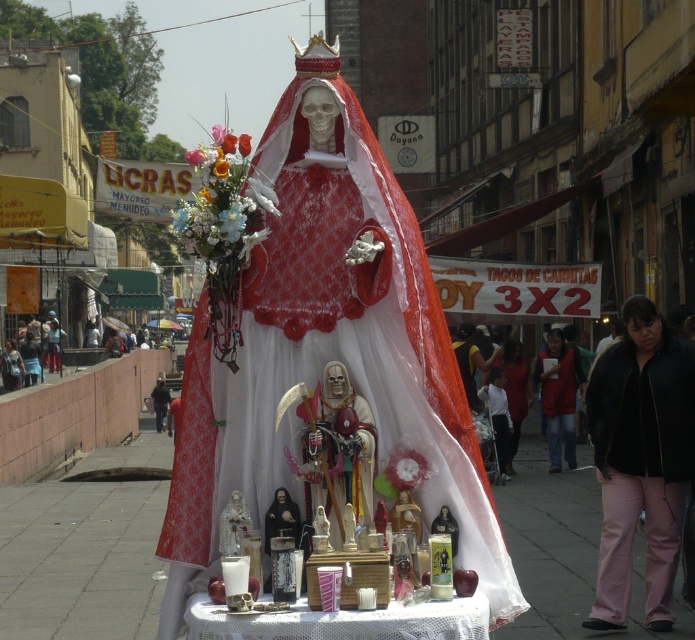
Question: Is white lace tablecloth at center thinner than red fabric vest at center?

Choices:
 (A) no
 (B) yes

Answer: (A)

Question: Is matte red fabric altar at center above white lace tablecloth at center?

Choices:
 (A) yes
 (B) no

Answer: (A)

Question: Which of these objects is positioned farthest from the pink fabric pants at lower right?

Choices:
 (A) matte red fabric altar at center
 (B) white lace tablecloth at center

Answer: (A)

Question: From the image, what is the correct spatial relationship of matte red fabric altar at center in relation to pink fabric pants at lower right?

Choices:
 (A) right
 (B) left

Answer: (B)

Question: Which point is closer to the camera?

Choices:
 (A) matte red fabric altar at center
 (B) red fabric vest at center

Answer: (A)

Question: Which point is farther to the camera?

Choices:
 (A) (670, 464)
 (B) (573, 349)
 (C) (270, 632)

Answer: (B)